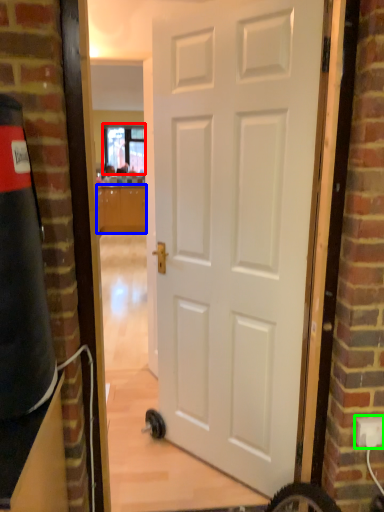
Question: Considering the real-world distances, which object is closest to window (highlighted by a red box)? cabinetry (highlighted by a blue box) or electric outlet (highlighted by a green box).

Choices:
 (A) cabinetry
 (B) electric outlet

Answer: (A)